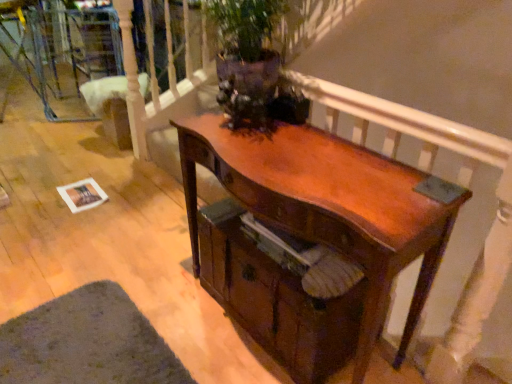
Question: Is shiny brown wood desk at center at the back of shiny brown drawer at center?

Choices:
 (A) yes
 (B) no

Answer: (A)

Question: Is shiny brown drawer at center positioned far away from shiny brown wood desk at center?

Choices:
 (A) yes
 (B) no

Answer: (B)

Question: Is shiny brown drawer at center thinner than shiny brown wood desk at center?

Choices:
 (A) yes
 (B) no

Answer: (B)

Question: From the image's perspective, would you say shiny brown drawer at center is positioned over shiny brown wood desk at center?

Choices:
 (A) no
 (B) yes

Answer: (A)

Question: Considering the relative sizes of shiny brown drawer at center and shiny brown wood desk at center in the image provided, is shiny brown drawer at center wider than shiny brown wood desk at center?

Choices:
 (A) no
 (B) yes

Answer: (B)

Question: Is shiny brown wood desk at center taller or shorter than green felt mat at lower left?

Choices:
 (A) tall
 (B) short

Answer: (A)

Question: Considering the relative positions of shiny brown wood desk at center and green felt mat at lower left in the image provided, is shiny brown wood desk at center to the left or to the right of green felt mat at lower left?

Choices:
 (A) left
 (B) right

Answer: (B)

Question: Looking at their shapes, would you say shiny brown wood desk at center is wider or thinner than green felt mat at lower left?

Choices:
 (A) thin
 (B) wide

Answer: (A)

Question: Relative to green felt mat at lower left, is shiny brown wood desk at center in front or behind?

Choices:
 (A) front
 (B) behind

Answer: (A)

Question: In terms of width, does wooden armchair at center look wider or thinner when compared to shiny brown drawer at center?

Choices:
 (A) thin
 (B) wide

Answer: (A)

Question: From a real-world perspective, is wooden armchair at center positioned above or below shiny brown drawer at center?

Choices:
 (A) below
 (B) above

Answer: (A)

Question: From the image's perspective, is wooden armchair at center located above or below shiny brown drawer at center?

Choices:
 (A) below
 (B) above

Answer: (B)

Question: Considering their positions, is wooden armchair at center located in front of or behind shiny brown drawer at center?

Choices:
 (A) behind
 (B) front

Answer: (A)

Question: Looking at their shapes, would you say shiny brown drawer at center is wider or thinner than green felt mat at lower left?

Choices:
 (A) thin
 (B) wide

Answer: (A)

Question: From a real-world perspective, is shiny brown drawer at center above or below green felt mat at lower left?

Choices:
 (A) above
 (B) below

Answer: (A)